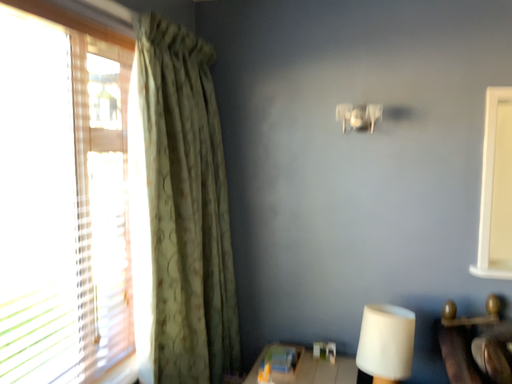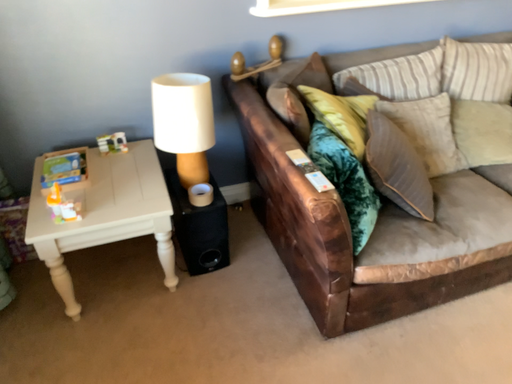
Question: How did the camera likely rotate when shooting the video?

Choices:
 (A) rotated downward
 (B) rotated upward

Answer: (A)